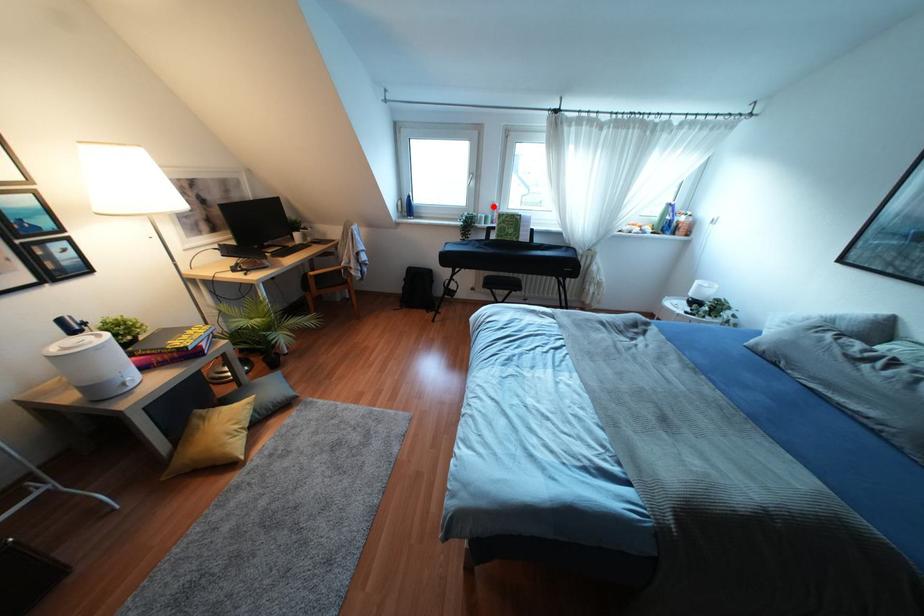
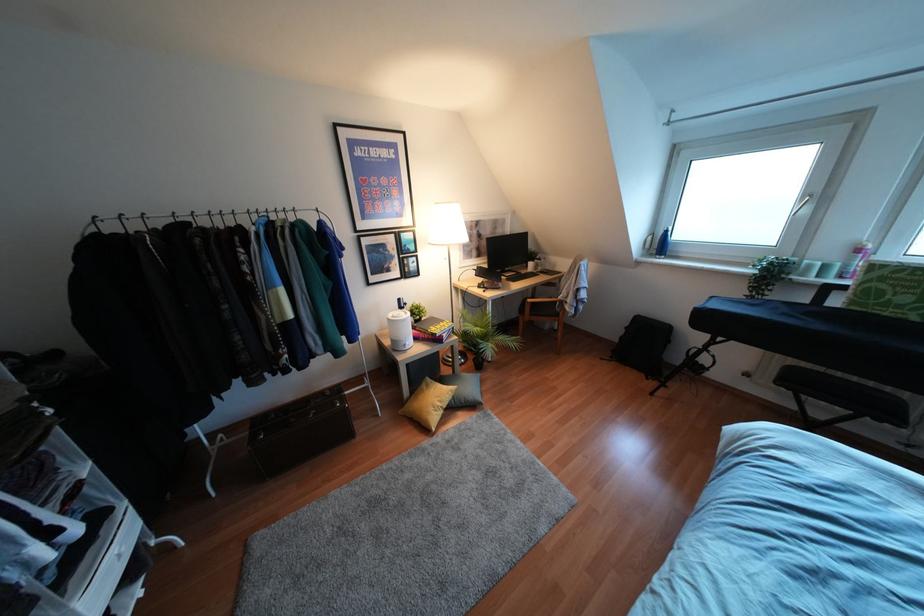
Locate, in the second image, the point that corresponds to the highlighted location in the first image.

(858, 249)